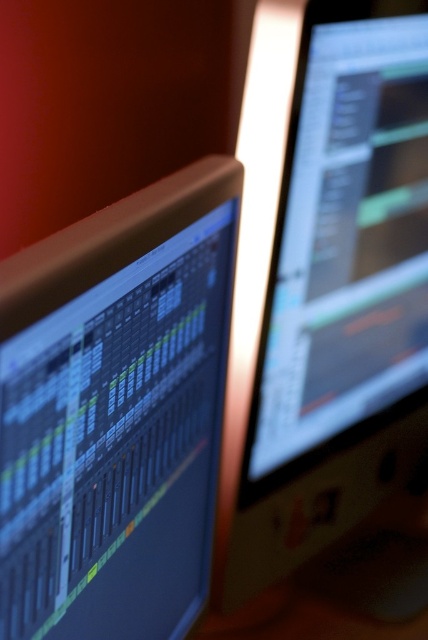
Looking at this image, does matte black monitor at left appear on the left side of satin black monitor at upper right?

Correct, you'll find matte black monitor at left to the left of satin black monitor at upper right.

Is matte black monitor at left to the right of satin black monitor at upper right from the viewer's perspective?

In fact, matte black monitor at left is to the left of satin black monitor at upper right.

What do you see at coordinates (115, 412) in the screenshot? I see `matte black monitor at left` at bounding box center [115, 412].

Where is `matte black monitor at left`? The image size is (428, 640). matte black monitor at left is located at coordinates (115, 412).